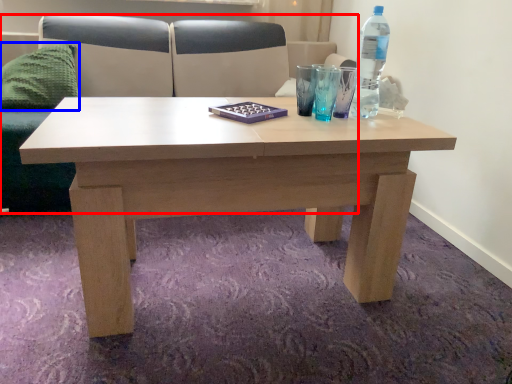
Question: Which point is further to the camera, couch (highlighted by a red box) or pillow (highlighted by a blue box)?

Choices:
 (A) couch
 (B) pillow

Answer: (B)